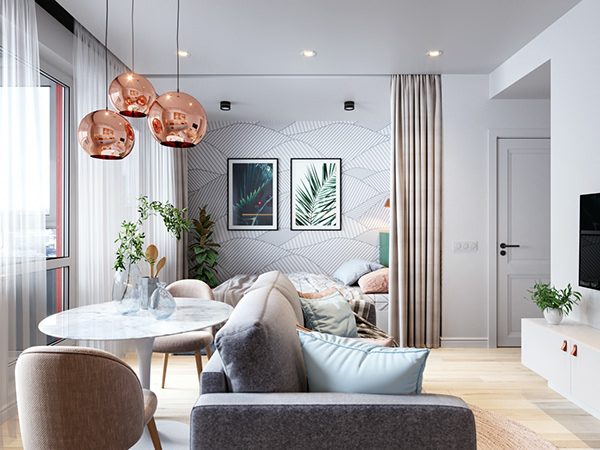
Identify the location of beige cloth dining room chair. (83, 403).